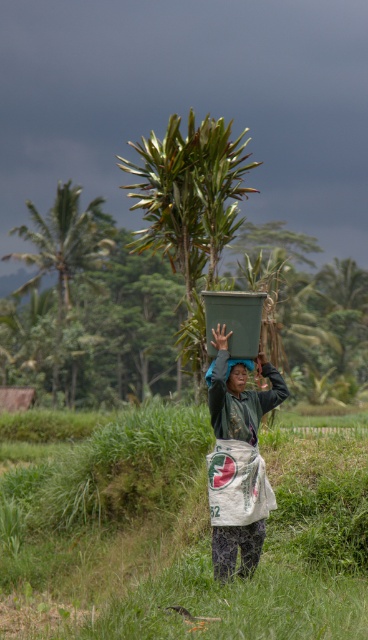
Is green matte box at center below matte green head at center?

Indeed, green matte box at center is positioned under matte green head at center.

Is point (218, 467) closer to camera compared to point (228, 384)?

That is True.

At what (x,y) coordinates should I click in order to perform the action: click on green matte box at center. Please return your answer as a coordinate pair (x, y). Looking at the image, I should click on (238, 465).

Consider the image. Does green grass at center have a smaller size compared to matte green head at center?

No, green grass at center is not smaller than matte green head at center.

Between green grass at center and matte green head at center, which one appears on the left side from the viewer's perspective?

From the viewer's perspective, green grass at center appears more on the left side.

Where is `green grass at center`? The height and width of the screenshot is (640, 368). green grass at center is located at coordinates (174, 531).

Find the location of a particular element. This screenshot has height=640, width=368. green grass at center is located at coordinates (174, 531).

Is green grass at center to the right of green matte box at center from the viewer's perspective?

In fact, green grass at center is to the left of green matte box at center.

Does green grass at center have a greater width compared to green matte box at center?

Yes, green grass at center is wider than green matte box at center.

Which is in front, point (69, 544) or point (216, 499)?

Point (216, 499) is more forward.

Where is `green grass at center`? green grass at center is located at coordinates (174, 531).